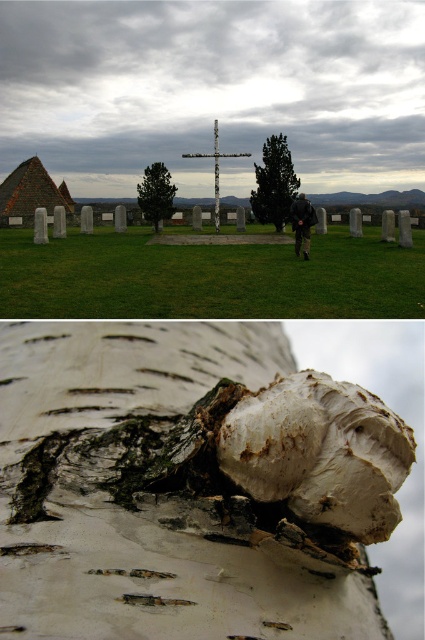
Question: Does white textured mushroom at center have a greater width compared to green bark tree at center?

Choices:
 (A) yes
 (B) no

Answer: (B)

Question: Is white bark hut at left above green bark tree at center?

Choices:
 (A) yes
 (B) no

Answer: (A)

Question: Which object is closer to the camera taking this photo?

Choices:
 (A) white bark hut at left
 (B) white textured mushroom at center
 (C) green bark tree at center
 (D) white birch bark at center

Answer: (D)

Question: Among these objects, which one is nearest to the camera?

Choices:
 (A) white birch bark at center
 (B) white bark hut at left
 (C) green bark tree at center

Answer: (A)

Question: Does white birch bark at center have a greater width compared to white textured mushroom at center?

Choices:
 (A) yes
 (B) no

Answer: (B)

Question: Which of these objects is positioned closest to the white textured mushroom at center?

Choices:
 (A) green bark tree at center
 (B) white bark hut at left

Answer: (A)